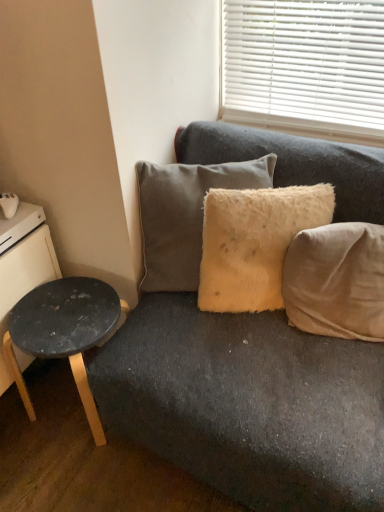
Question: Is black wood dresser at left shorter than beige fabric pillow at right, acting as the 3th pillow starting from the left?

Choices:
 (A) yes
 (B) no

Answer: (B)

Question: From a real-world perspective, is black wood dresser at left physically above beige fabric pillow at right, acting as the 3th pillow starting from the left?

Choices:
 (A) no
 (B) yes

Answer: (A)

Question: Does black wood dresser at left have a lesser width compared to beige fabric pillow at right, which is counted as the 1th pillow, starting from the right?

Choices:
 (A) no
 (B) yes

Answer: (A)

Question: Does black wood dresser at left have a larger size compared to beige fabric pillow at right, acting as the 3th pillow starting from the left?

Choices:
 (A) no
 (B) yes

Answer: (B)

Question: Can you confirm if black wood dresser at left is positioned to the right of beige fabric pillow at right, acting as the 3th pillow starting from the left?

Choices:
 (A) no
 (B) yes

Answer: (A)

Question: From a real-world perspective, is fuzzy yellow pillow at center, marked as the 2th pillow in a left-to-right arrangement, positioned above or below matte black stool at lower left?

Choices:
 (A) above
 (B) below

Answer: (A)

Question: Is point (203, 261) positioned closer to the camera than point (66, 343)?

Choices:
 (A) closer
 (B) farther

Answer: (B)

Question: Looking at their shapes, would you say fuzzy yellow pillow at center, the 2th pillow when ordered from right to left, is wider or thinner than matte black stool at lower left?

Choices:
 (A) wide
 (B) thin

Answer: (B)

Question: Would you say fuzzy yellow pillow at center, the 2th pillow when ordered from right to left, is to the left or to the right of matte black stool at lower left in the picture?

Choices:
 (A) left
 (B) right

Answer: (B)

Question: From a real-world perspective, is white glossy drawer at left above or below matte black stool at lower left?

Choices:
 (A) above
 (B) below

Answer: (A)

Question: From the image's perspective, is white glossy drawer at left positioned above or below matte black stool at lower left?

Choices:
 (A) below
 (B) above

Answer: (B)

Question: In terms of size, does white glossy drawer at left appear bigger or smaller than matte black stool at lower left?

Choices:
 (A) big
 (B) small

Answer: (B)

Question: Looking at their shapes, would you say white glossy drawer at left is wider or thinner than matte black stool at lower left?

Choices:
 (A) wide
 (B) thin

Answer: (B)

Question: Is white glossy drawer at left bigger or smaller than fuzzy yellow pillow at center, the 2th pillow when ordered from right to left?

Choices:
 (A) big
 (B) small

Answer: (B)

Question: Is white glossy drawer at left in front of or behind fuzzy yellow pillow at center, the 2th pillow when ordered from right to left, in the image?

Choices:
 (A) behind
 (B) front

Answer: (A)